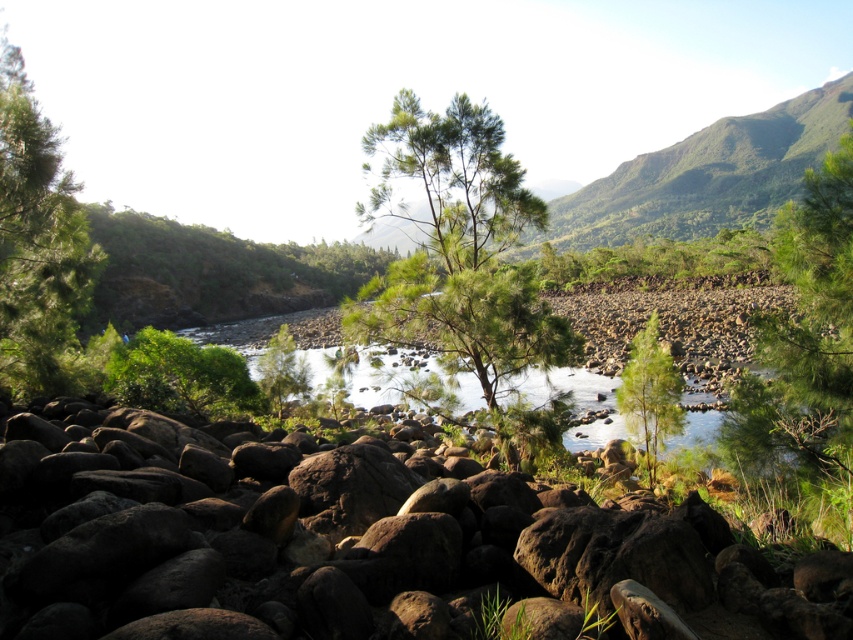
Question: Which of the following is the closest to the observer?

Choices:
 (A) green matte tree at left
 (B) green matte tree at center
 (C) green needle-like leaves at center

Answer: (A)

Question: Considering the real-world distances, which object is farthest from the green matte tree at center?

Choices:
 (A) green leafy tree at center
 (B) green leafy tree at left
 (C) green needle-like leaves at center

Answer: (A)

Question: Which object is positioned closest to the brown rough rock at center?

Choices:
 (A) green matte tree at center
 (B) green matte tree at left

Answer: (B)

Question: Is brown rough rock at center closer to camera compared to green matte tree at center?

Choices:
 (A) yes
 (B) no

Answer: (A)

Question: Does brown rough rock at center appear under green matte tree at right?

Choices:
 (A) no
 (B) yes

Answer: (B)

Question: Does brown rough rock at center come in front of green matte tree at center?

Choices:
 (A) no
 (B) yes

Answer: (B)